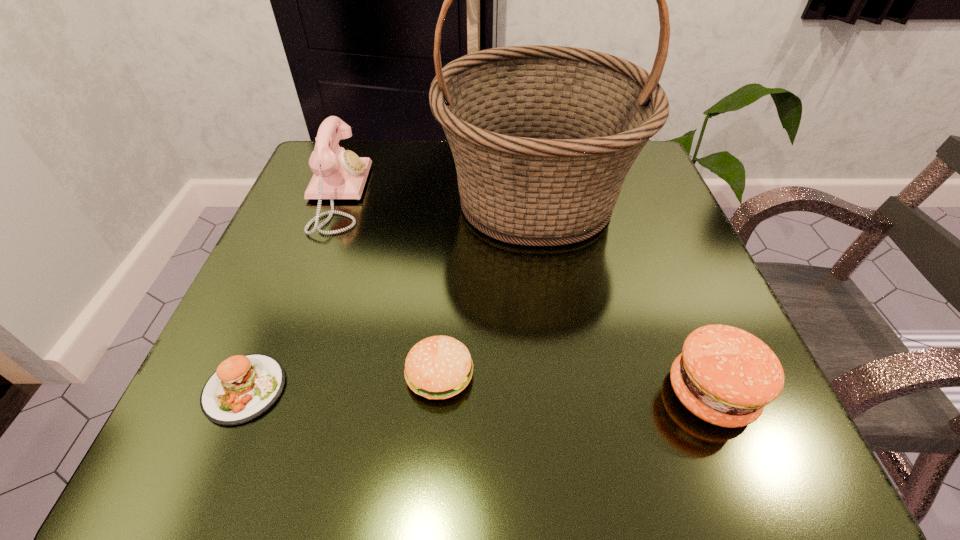
Find the location of `free space located on the left of the third shortest object`. free space located on the left of the third shortest object is located at coordinates (469, 393).

The width and height of the screenshot is (960, 540). I want to click on blank area located on the back of the second patty from right to left, so click(x=445, y=300).

The image size is (960, 540). Find the location of `free space located on the right of the shortest object`. free space located on the right of the shortest object is located at coordinates (335, 389).

I want to click on basket that is positioned at the far edge, so click(x=543, y=137).

Find the location of a particular element. Image resolution: width=960 pixels, height=540 pixels. telephone present at the far edge is located at coordinates (338, 174).

You are a GUI agent. You are given a task and a screenshot of the screen. Output one action in this format:
    pyautogui.click(x=<x>, y=<y>)
    Task: Click on the telephone that is at the left edge
    The width and height of the screenshot is (960, 540).
    Given the screenshot: What is the action you would take?
    pyautogui.click(x=338, y=174)

The width and height of the screenshot is (960, 540). Find the location of `patty situated at the left edge`. patty situated at the left edge is located at coordinates (243, 387).

Identify the location of basket that is at the right edge. This screenshot has height=540, width=960. (543, 137).

Where is `patty at the right edge`? patty at the right edge is located at coordinates (725, 376).

You are a GUI agent. You are given a task and a screenshot of the screen. Output one action in this format:
    pyautogui.click(x=<x>, y=<y>)
    Task: Click on the object that is at the far left corner
    This screenshot has width=960, height=540.
    Given the screenshot: What is the action you would take?
    pyautogui.click(x=338, y=174)